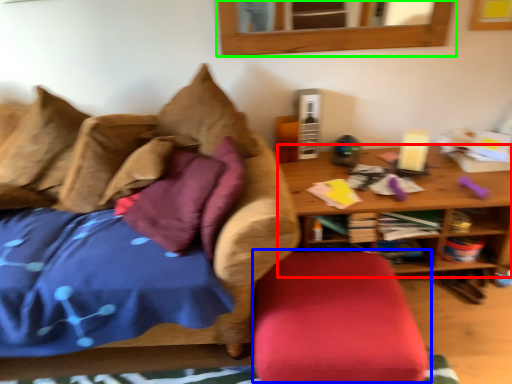
Question: Which object is positioned farthest from table (highlighted by a red box)? Select from swivel chair (highlighted by a blue box) and mirror (highlighted by a green box).

Choices:
 (A) swivel chair
 (B) mirror

Answer: (B)